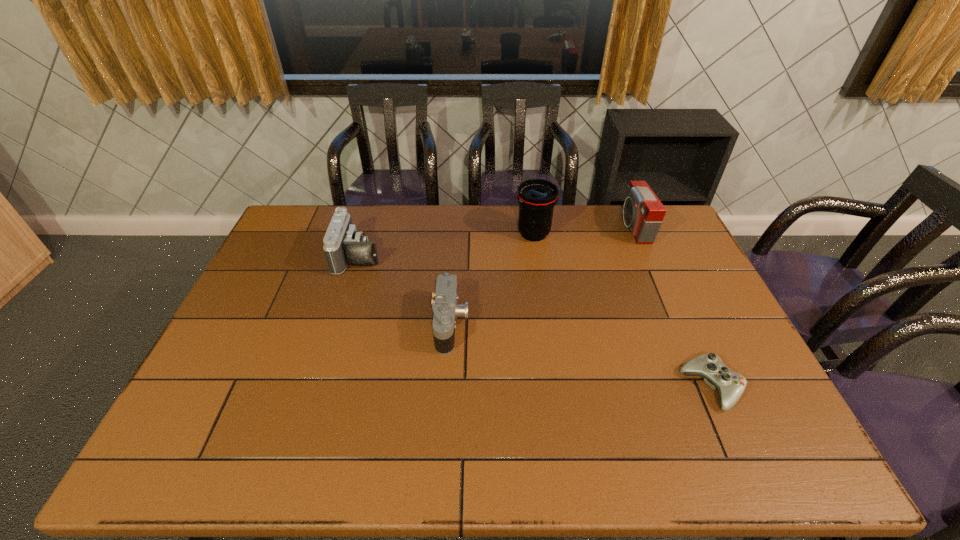
Identify the location of vacant area that lies between the shortest camera and the shortest object. (581, 355).

This screenshot has height=540, width=960. I want to click on vacant area that lies between the tallest object and the second shortest object, so click(x=492, y=279).

Locate an element on the screen. The width and height of the screenshot is (960, 540). vacant area that lies between the second nearest object and the rightmost camera is located at coordinates (542, 275).

Find the location of a particular element. the fourth closest object to the leftmost camera is located at coordinates (x=730, y=385).

The image size is (960, 540). I want to click on object that is the closest to the shortest object, so click(643, 212).

The image size is (960, 540). I want to click on camera that is the closest to the leftmost camera, so click(x=446, y=309).

Identify the location of the closest camera to the leftmost object. (446, 309).

The width and height of the screenshot is (960, 540). I want to click on free spot that satisfies the following two spatial constraints: 1. on the front-facing side of the nearest object; 2. on the right side of the rightmost camera, so click(702, 387).

Locate an element on the screen. The width and height of the screenshot is (960, 540). vacant space that satisfies the following two spatial constraints: 1. on the front-facing side of the rightmost camera; 2. on the front side of the tallest object is located at coordinates pos(636,234).

The image size is (960, 540). Find the location of `free spot that satisfies the following two spatial constraints: 1. at the front of the leftmost object with an open lens cover; 2. on the right side of the shortest object`. free spot that satisfies the following two spatial constraints: 1. at the front of the leftmost object with an open lens cover; 2. on the right side of the shortest object is located at coordinates (318, 387).